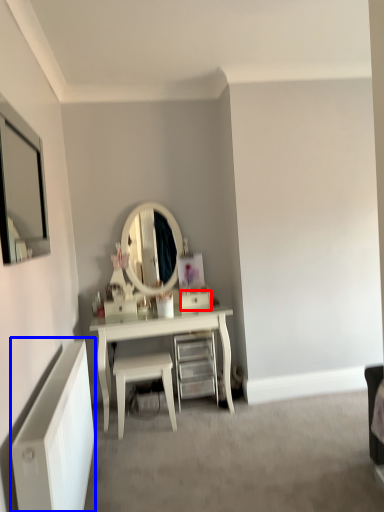
Question: Which object appears closest to the camera in this image, drawer (highlighted by a red box) or radiator (highlighted by a blue box)?

Choices:
 (A) drawer
 (B) radiator

Answer: (B)